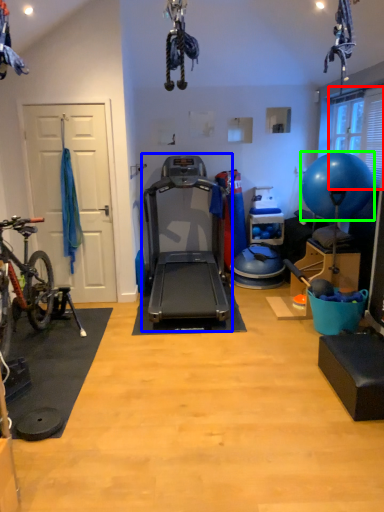
Question: Based on their relative distances, which object is nearer to window screen (highlighted by a red box)? Choose from treadmill (highlighted by a blue box) and ball (highlighted by a green box).

Choices:
 (A) treadmill
 (B) ball

Answer: (B)